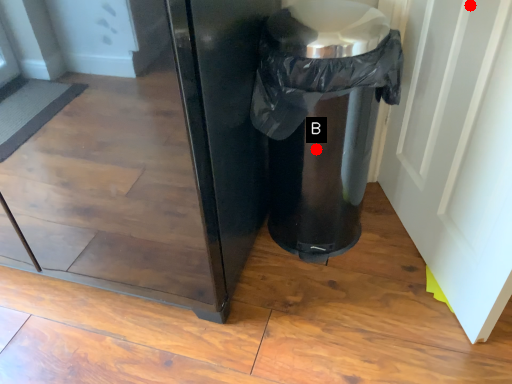
Question: Two points are circled on the image, labeled by A and B beside each circle. Among these points, which one is nearest to the camera?

Choices:
 (A) A is closer
 (B) B is closer

Answer: (A)